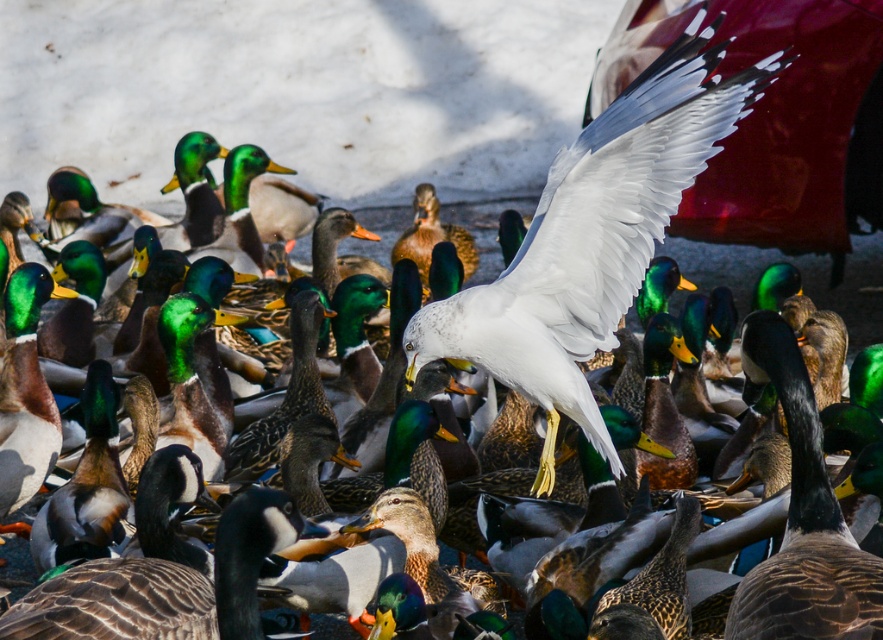
Describe the element at coordinates (804, 522) in the screenshot. I see `brown feathered duck at center` at that location.

Who is more distant from viewer, (775, 609) or (287, 499)?

The point (287, 499) is behind.

The height and width of the screenshot is (640, 883). What are the coordinates of `brown feathered duck at center` in the screenshot? It's located at (804, 522).

Is brown speckled goose at center to the left of green glossy duck at left from the viewer's perspective?

In fact, brown speckled goose at center is to the right of green glossy duck at left.

Who is shorter, brown speckled goose at center or green glossy duck at left?

With less height is brown speckled goose at center.

At what (x,y) coordinates should I click in order to perform the action: click on brown speckled goose at center. Please return your answer as a coordinate pair (x, y). Looking at the image, I should click on (167, 584).

Is white feathered seagull at center behind green glossy duck at left?

No, it is not.

Is point (631, 234) positioned before point (23, 486)?

Yes, point (631, 234) is in front of point (23, 486).

Image resolution: width=883 pixels, height=640 pixels. Identify the location of white feathered seagull at center. (593, 237).